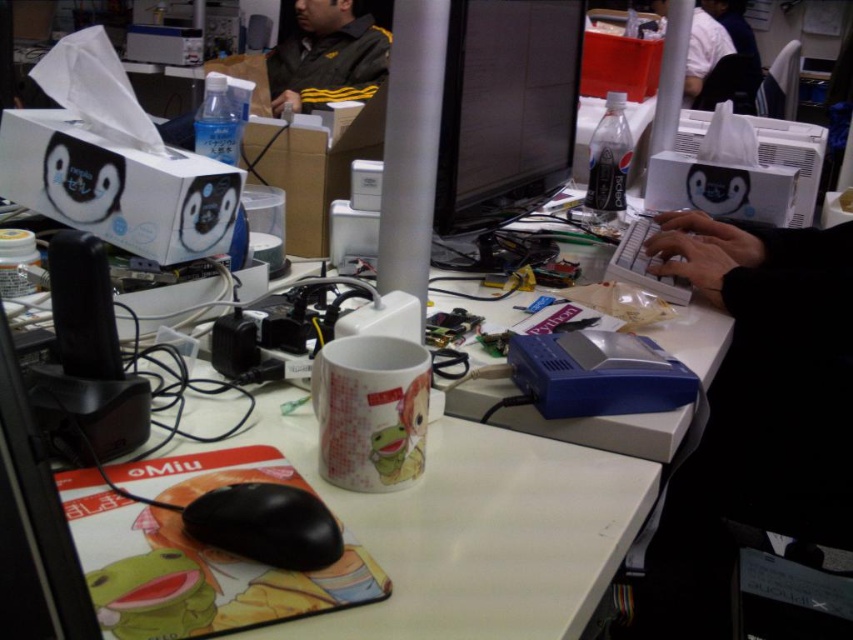
Image resolution: width=853 pixels, height=640 pixels. What are the coordinates of `matte black monitor at center` in the screenshot? It's located at (x=506, y=108).

Between matte black monitor at center and black plastic mouse at lower left, which one appears on the right side from the viewer's perspective?

matte black monitor at center is more to the right.

Who is more distant from viewer, (564, 179) or (265, 518)?

Positioned behind is point (564, 179).

This screenshot has width=853, height=640. I want to click on matte black monitor at center, so 506,108.

Is matte black monitor at center to the left of dark green jacket at upper center from the viewer's perspective?

Incorrect, matte black monitor at center is not on the left side of dark green jacket at upper center.

Does matte black monitor at center have a greater height compared to dark green jacket at upper center?

No.

Does point (448, 106) come farther from viewer compared to point (286, 81)?

That is False.

Identify the location of matte black monitor at center. [506, 108].

Between dark green jacket at upper center and black plastic mouse at lower left, which one has more height?

Standing taller between the two is dark green jacket at upper center.

Is dark green jacket at upper center positioned in front of black plastic mouse at lower left?

No, it is behind black plastic mouse at lower left.

This screenshot has height=640, width=853. What do you see at coordinates (328, 56) in the screenshot?
I see `dark green jacket at upper center` at bounding box center [328, 56].

This screenshot has height=640, width=853. In order to click on dark green jacket at upper center in this screenshot , I will do `click(328, 56)`.